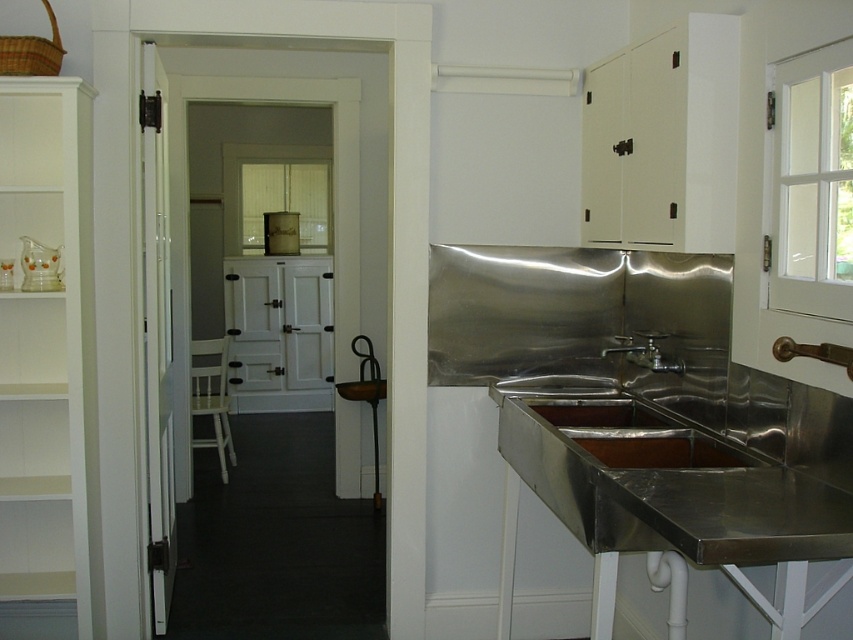
Does stainless steel sink at lower right appear on the right side of silver metallic faucet at center?

In fact, stainless steel sink at lower right is to the left of silver metallic faucet at center.

Is the position of stainless steel sink at lower right more distant than that of silver metallic faucet at center?

That is False.

The image size is (853, 640). What do you see at coordinates (689, 474) in the screenshot? I see `stainless steel sink at lower right` at bounding box center [689, 474].

At what (x,y) coordinates should I click in order to perform the action: click on stainless steel sink at lower right. Please return your answer as a coordinate pair (x, y). The image size is (853, 640). Looking at the image, I should click on (689, 474).